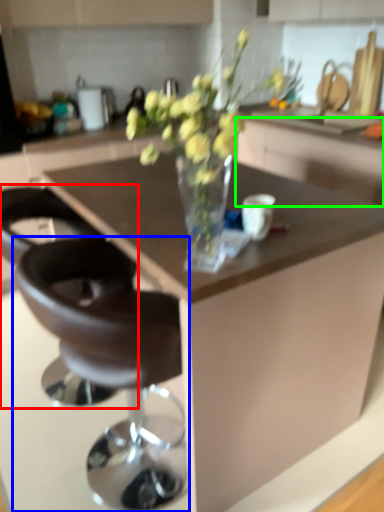
Question: Which object is the closest to the chair (highlighted by a red box)? Choose among these: chair (highlighted by a blue box) or cabinetry (highlighted by a green box).

Choices:
 (A) chair
 (B) cabinetry

Answer: (A)